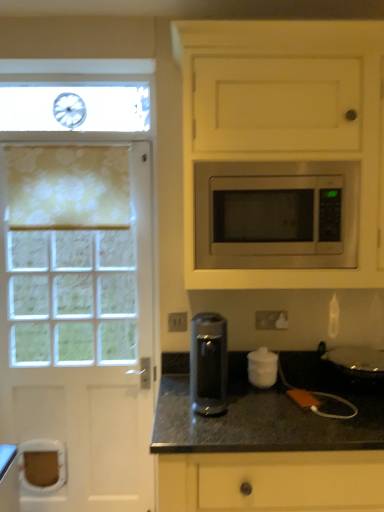
What do you see at coordinates (78, 285) in the screenshot? Image resolution: width=384 pixels, height=512 pixels. I see `white textured door at left` at bounding box center [78, 285].

In order to face satin white microwave at upper center, should I rotate leftwards or rightwards?

To align with it, rotate right about 12.931°.

What do you see at coordinates (208, 362) in the screenshot? I see `sleek metallic coffee maker at center` at bounding box center [208, 362].

This screenshot has width=384, height=512. Identify the location of yellow floral fabric at left. (68, 187).

What's the angular difference between sleek metallic coffee maker at center and granite/black at lower center's facing directions?

The facing directions of sleek metallic coffee maker at center and granite/black at lower center are 5.99 degrees apart.

Consider the image. Who is taller, sleek metallic coffee maker at center or granite/black at lower center?

With more height is granite/black at lower center.

Which of these two, sleek metallic coffee maker at center or granite/black at lower center, is bigger?

Bigger between the two is granite/black at lower center.

Does sleek metallic coffee maker at center appear on the left side of granite/black at lower center?

Yes, sleek metallic coffee maker at center is to the left of granite/black at lower center.

What's the angular difference between white textured door at left and granite/black at lower center's facing directions?

2.29 degrees separate the facing orientations of white textured door at left and granite/black at lower center.

Does white textured door at left have a greater height compared to granite/black at lower center?

Correct, white textured door at left is much taller as granite/black at lower center.

Is white textured door at left inside the boundaries of granite/black at lower center, or outside?

white textured door at left is spatially situated outside granite/black at lower center.

Relative to granite/black at lower center, is white textured door at left in front or behind?

white textured door at left is positioned farther from the viewer than granite/black at lower center.

Is the position of satin white microwave at upper center more distant than that of sleek metallic coffee maker at center?

No, satin white microwave at upper center is closer to the camera.

I want to click on kitchen appliance behind the satin white microwave at upper center, so click(x=208, y=362).

In terms of width, does satin white microwave at upper center look wider or thinner when compared to sleek metallic coffee maker at center?

satin white microwave at upper center is wider than sleek metallic coffee maker at center.

Can you tell me how much satin white microwave at upper center and yellow floral fabric at left differ in facing direction?

1.69 degrees separate the facing orientations of satin white microwave at upper center and yellow floral fabric at left.

Is satin white microwave at upper center next to yellow floral fabric at left and touching it?

No, satin white microwave at upper center is not beside yellow floral fabric at left.

Does satin white microwave at upper center appear on the right side of yellow floral fabric at left?

Yes, satin white microwave at upper center is to the right of yellow floral fabric at left.

Is satin white microwave at upper center in front of or behind yellow floral fabric at left in the image?

satin white microwave at upper center is in front of yellow floral fabric at left.

Which is correct: yellow floral fabric at left is inside white textured door at left, or outside of it?

yellow floral fabric at left can be found inside white textured door at left.

Is yellow floral fabric at left facing towards white textured door at left?

Yes, yellow floral fabric at left is turned towards white textured door at left.

Are yellow floral fabric at left and white textured door at left beside each other?

No, yellow floral fabric at left is not making contact with white textured door at left.

Does yellow floral fabric at left have a lesser width compared to white textured door at left?

Yes.

Does point (102, 144) lie in front of point (269, 370)?

No, it is behind (269, 370).

The height and width of the screenshot is (512, 384). What are the coordinates of `door behind the white matte sugar container at center` in the screenshot? It's located at (78, 285).

Considering the sizes of white textured door at left and white matte sugar container at center in the image, is white textured door at left wider or thinner than white matte sugar container at center?

Clearly, white textured door at left has more width compared to white matte sugar container at center.

Is white textured door at left taller than white matte sugar container at center?

Correct, white textured door at left is much taller as white matte sugar container at center.

Find the location of a particular element. cabinetry on the right of white matte sugar container at center is located at coordinates (284, 124).

Is white matte sugar container at center located outside satin white microwave at upper center?

Yes, white matte sugar container at center is located beyond the bounds of satin white microwave at upper center.

From the image's perspective, which is above, white matte sugar container at center or satin white microwave at upper center?

satin white microwave at upper center appears higher in the image.

Is point (249, 370) closer to viewer compared to point (186, 57)?

No.

Identify the location of kitchen appliance above the granite/black at lower center (from a real-world perspective). (208, 362).

You are a GUI agent. You are given a task and a screenshot of the screen. Output one action in this format:
    pyautogui.click(x=<x>, y=<y>)
    Task: Click on the door above the granite/black at lower center (from the image's perspective)
    The width and height of the screenshot is (384, 512).
    Given the screenshot: What is the action you would take?
    pyautogui.click(x=78, y=285)

From the image, which object appears to be farther from white matte sugar container at center, yellow floral fabric at left or satin silver microwave at upper right?

yellow floral fabric at left.

Which object lies further to the anchor point sleek metallic coffee maker at center, granite/black at lower center or yellow floral fabric at left?

yellow floral fabric at left.

Estimate the real-world distances between objects in this image. Which object is closer to white textured door at left, yellow floral fabric at left or satin white microwave at upper center?

Among the two, yellow floral fabric at left is located nearer to white textured door at left.

Estimate the real-world distances between objects in this image. Which object is closer to satin silver microwave at upper right, sleek metallic coffee maker at center or white matte sugar container at center?

sleek metallic coffee maker at center lies closer to satin silver microwave at upper right than the other object.

Which object lies nearer to the anchor point sleek metallic coffee maker at center, granite/black at lower center or white textured door at left?

granite/black at lower center is closer to sleek metallic coffee maker at center.

When comparing their distances from sleek metallic coffee maker at center, does satin silver microwave at upper right or yellow floral fabric at left seem further?

yellow floral fabric at left is positioned further to the anchor sleek metallic coffee maker at center.

Which object lies nearer to the anchor point yellow floral fabric at left, white textured door at left or white matte sugar container at center?

white textured door at left.

Considering their positions, is yellow floral fabric at left positioned closer to white matte sugar container at center than sleek metallic coffee maker at center?

sleek metallic coffee maker at center.

Locate an element on the screen. kitchen appliance that lies between satin white microwave at upper center and white matte sugar container at center from top to bottom is located at coordinates (208, 362).

Where is `appliance between satin silver microwave at upper right and granite/black at lower center from top to bottom`? Image resolution: width=384 pixels, height=512 pixels. appliance between satin silver microwave at upper right and granite/black at lower center from top to bottom is located at coordinates (262, 368).

At what (x,y) coordinates should I click in order to perform the action: click on kitchen appliance located between white textured door at left and granite/black at lower center in the left-right direction. Please return your answer as a coordinate pair (x, y). This screenshot has width=384, height=512. Looking at the image, I should click on click(x=208, y=362).

The height and width of the screenshot is (512, 384). In order to click on kitchen appliance between yellow floral fabric at left and satin silver microwave at upper right in this screenshot , I will do `click(208, 362)`.